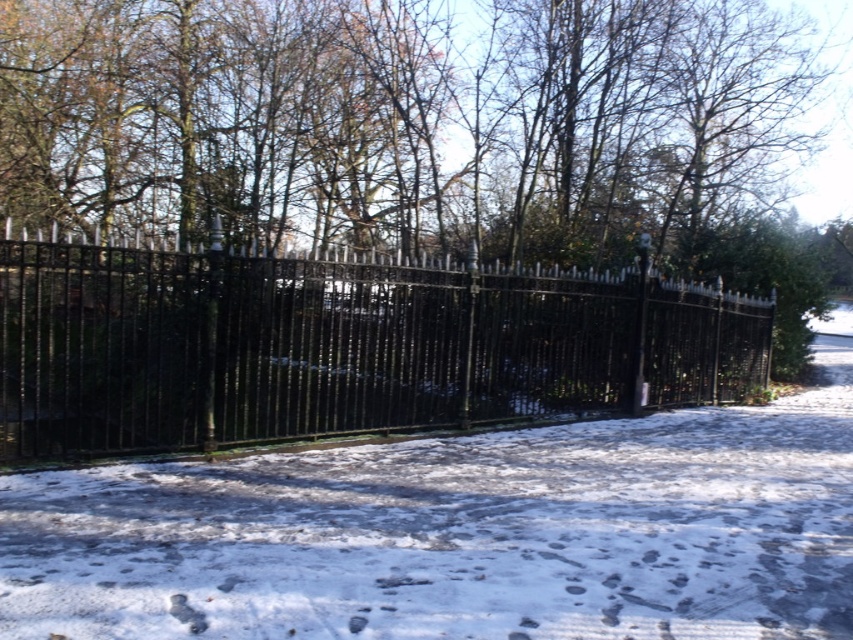
Does white snow at center appear on the left side of black wrought iron fence at center?

No, white snow at center is not to the left of black wrought iron fence at center.

Which is in front, point (224, 636) or point (485, 308)?

Point (224, 636) is more forward.

At what (x,y) coordinates should I click in order to perform the action: click on white snow at center. Please return your answer as a coordinate pair (x, y). This screenshot has height=640, width=853. Looking at the image, I should click on (460, 532).